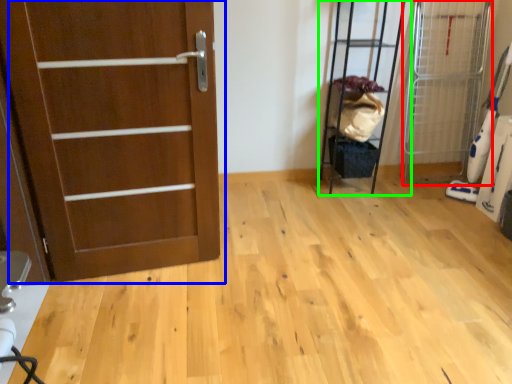
Question: Estimate the real-world distances between objects in this image. Which object is farther from elevator (highlighted by a red box), door (highlighted by a blue box) or elevator (highlighted by a green box)?

Choices:
 (A) door
 (B) elevator

Answer: (A)